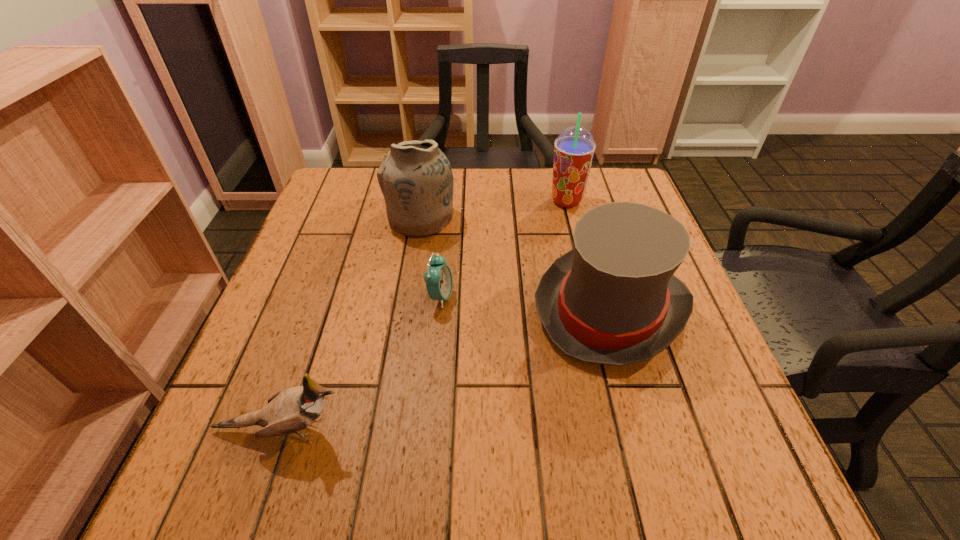
Locate an element on the screen. This screenshot has height=540, width=960. free area in between the bird and the dress hat is located at coordinates (446, 369).

Locate an element on the screen. This screenshot has width=960, height=540. object that can be found as the third closest to the smoothie is located at coordinates click(438, 277).

Identify which object is the nearest to the alarm clock. Please provide its 2D coordinates. Your answer should be formatted as a tuple, i.e. [(x, y)], where the tuple contains the x and y coordinates of a point satisfying the conditions above.

[(416, 179)]

Locate an element on the screen. The height and width of the screenshot is (540, 960). free space that satisfies the following two spatial constraints: 1. on the back side of the third shortest object; 2. on the face of the shortest object is located at coordinates (607, 297).

At what (x,y) coordinates should I click in order to perform the action: click on vacant region that satisfies the following two spatial constraints: 1. on the face of the alarm clock; 2. on the right side of the third tallest object. Please return your answer as a coordinate pair (x, y). Looking at the image, I should click on (439, 308).

Where is `vacant space that satisfies the following two spatial constraints: 1. on the face of the third shortest object; 2. on the left side of the alarm clock`? This screenshot has width=960, height=540. vacant space that satisfies the following two spatial constraints: 1. on the face of the third shortest object; 2. on the left side of the alarm clock is located at coordinates (439, 308).